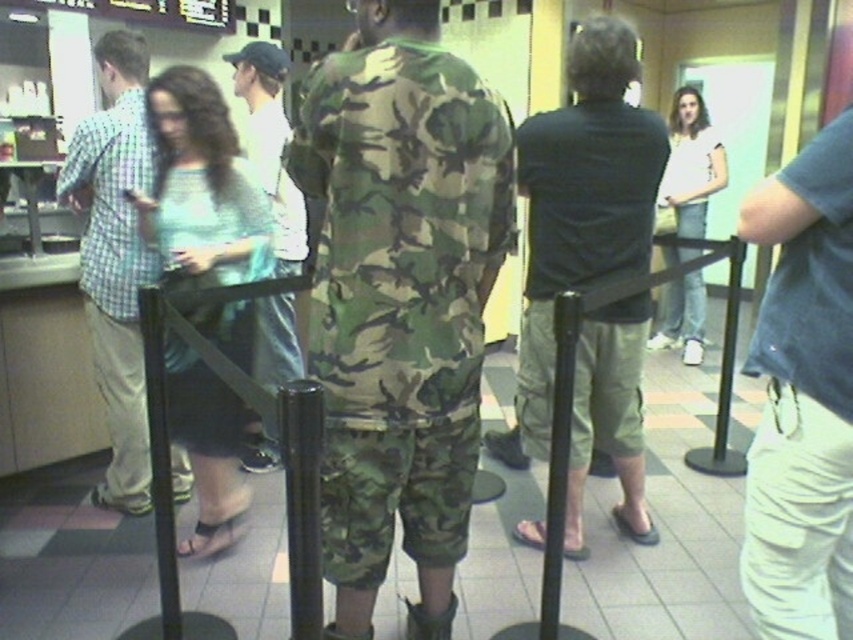
Question: Estimate the real-world distances between objects in this image. Which object is farther from the light blue fabric dress at center?

Choices:
 (A) camo fabric uniform at center
 (B) dark gray cotton t-shirt at right

Answer: (B)

Question: Among these objects, which one is nearest to the camera?

Choices:
 (A) black matte t-shirt at center
 (B) white cotton shirt at upper right
 (C) black plastic pole at center
 (D) light blue fabric dress at center

Answer: (C)

Question: Considering the relative positions of camo fabric uniform at center and checkered fabric shirt at left in the image provided, where is camo fabric uniform at center located with respect to checkered fabric shirt at left?

Choices:
 (A) right
 (B) left

Answer: (A)

Question: From the image, what is the correct spatial relationship of camo fabric uniform at center in relation to checkered fabric shirt at left?

Choices:
 (A) above
 (B) below

Answer: (B)

Question: Estimate the real-world distances between objects in this image. Which object is closer to the checkered fabric shirt at left?

Choices:
 (A) black matte t-shirt at center
 (B) black plastic pole at center
 (C) white cotton shirt at upper right

Answer: (B)

Question: Does dark gray cotton t-shirt at right appear on the right side of black rubber pole at center?

Choices:
 (A) yes
 (B) no

Answer: (A)